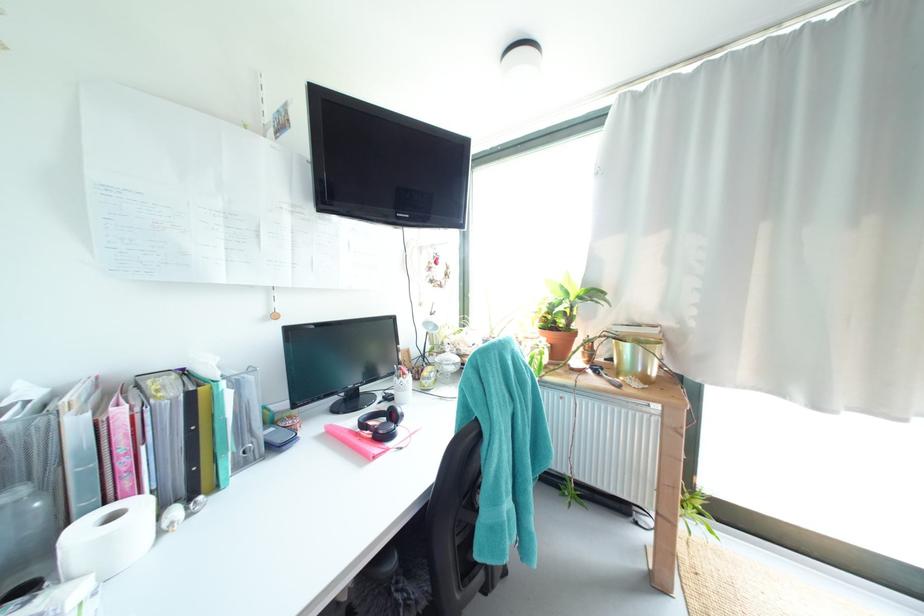
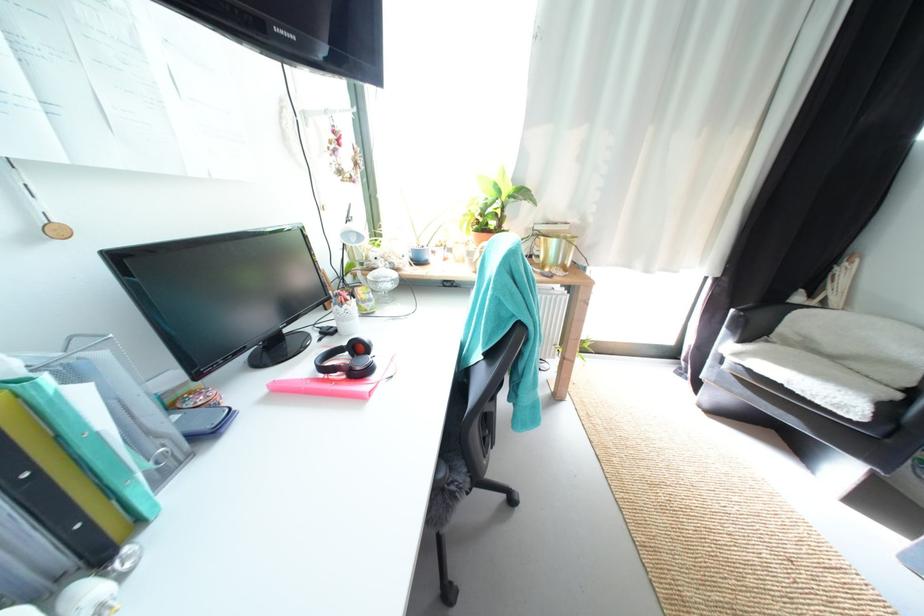
Find the pixel in the second image that matches (436,379) in the first image.

(378, 302)